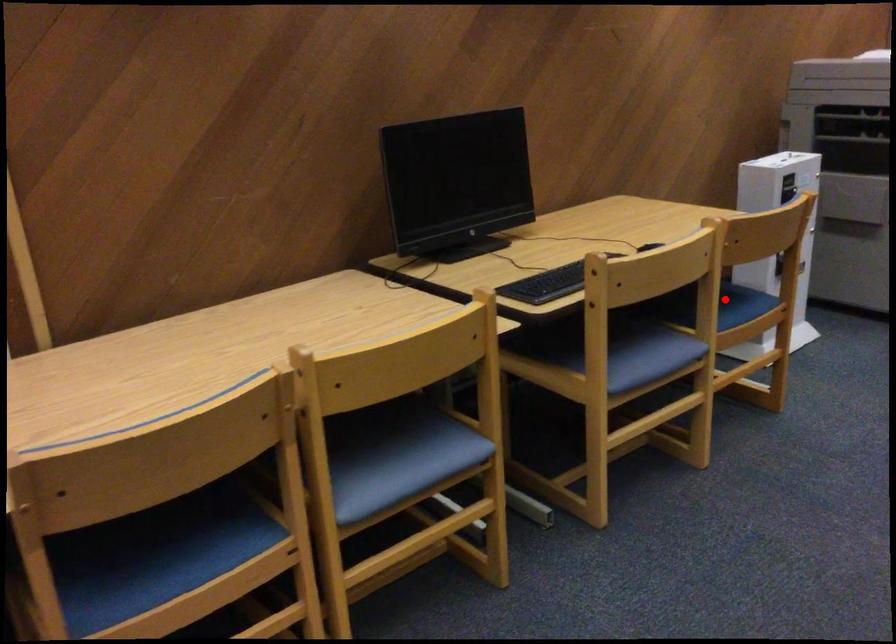
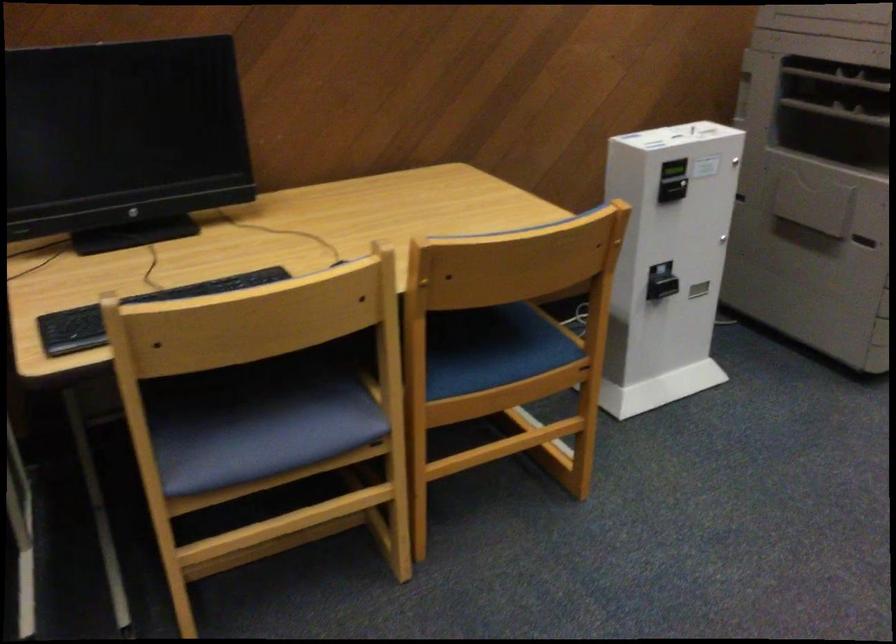
Question: I am providing you with two images of the same scene from different viewpoints. Given a red point in image1, look at the same physical point in image2. Is it:

Choices:
 (A) Closer to the viewpoint
 (B) Farther from the viewpoint

Answer: (A)